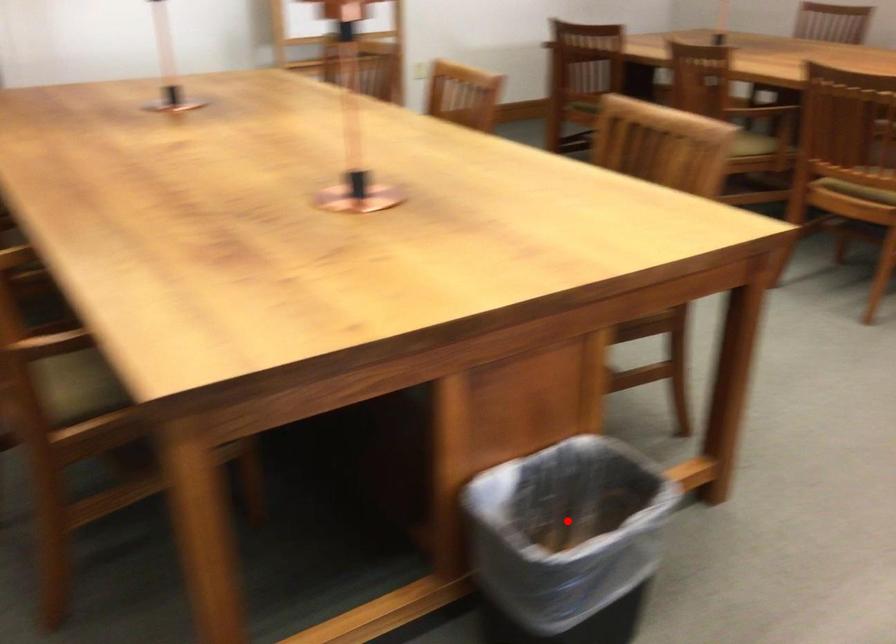
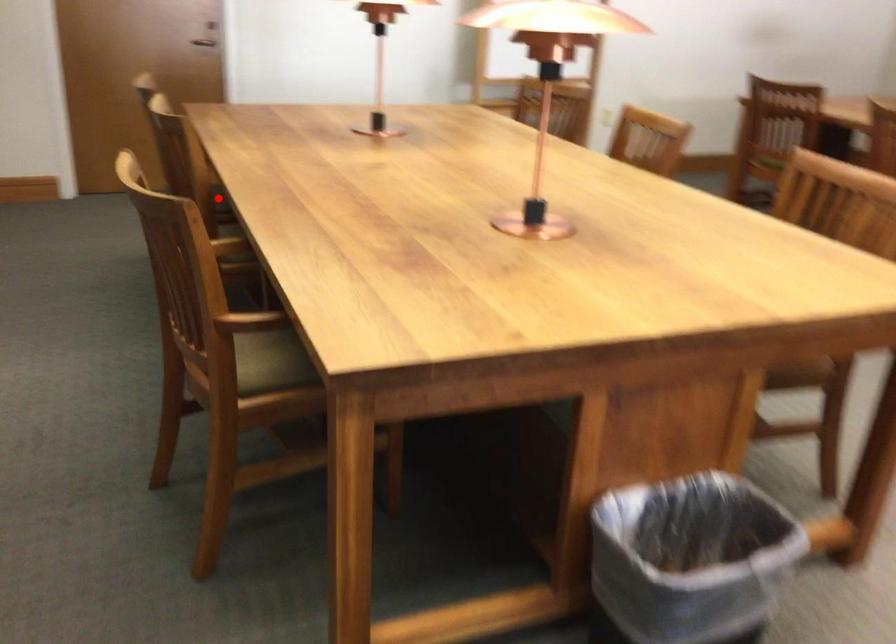
I am providing you with two images of the same scene from different viewpoints. A red point is marked on the first image and another point is marked on the second image. Does the point marked in image1 correspond to the same location as the one in image2?

No